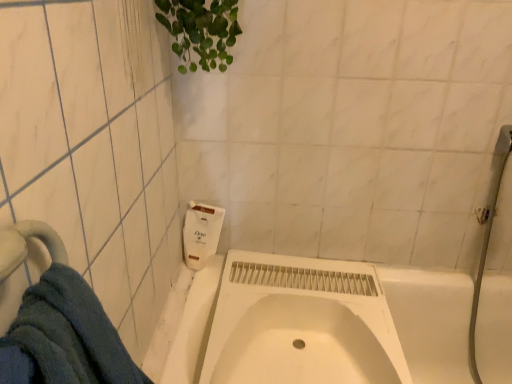
The height and width of the screenshot is (384, 512). In order to click on free location in front of white matte soap dispenser at upper center in this screenshot , I will do `click(196, 294)`.